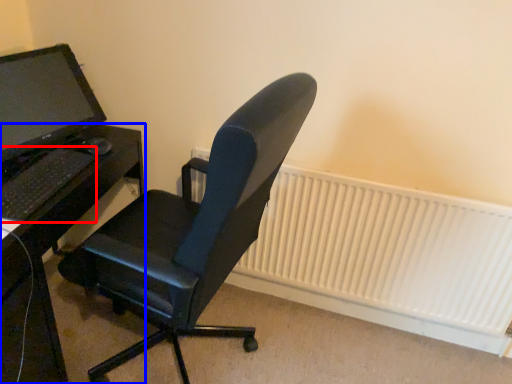
Question: Among these objects, which one is nearest to the camera, computer keyboard (highlighted by a red box) or desk (highlighted by a blue box)?

Choices:
 (A) computer keyboard
 (B) desk

Answer: (B)